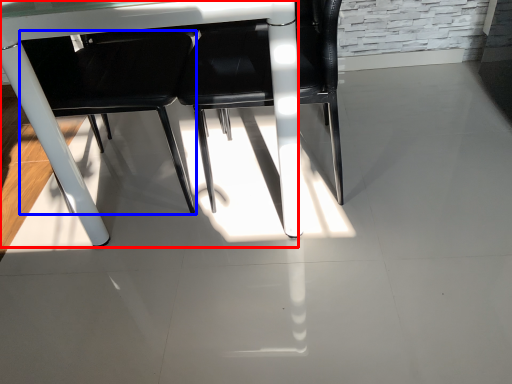
Question: Among these objects, which one is farthest to the camera, table (highlighted by a red box) or chair (highlighted by a blue box)?

Choices:
 (A) table
 (B) chair

Answer: (B)